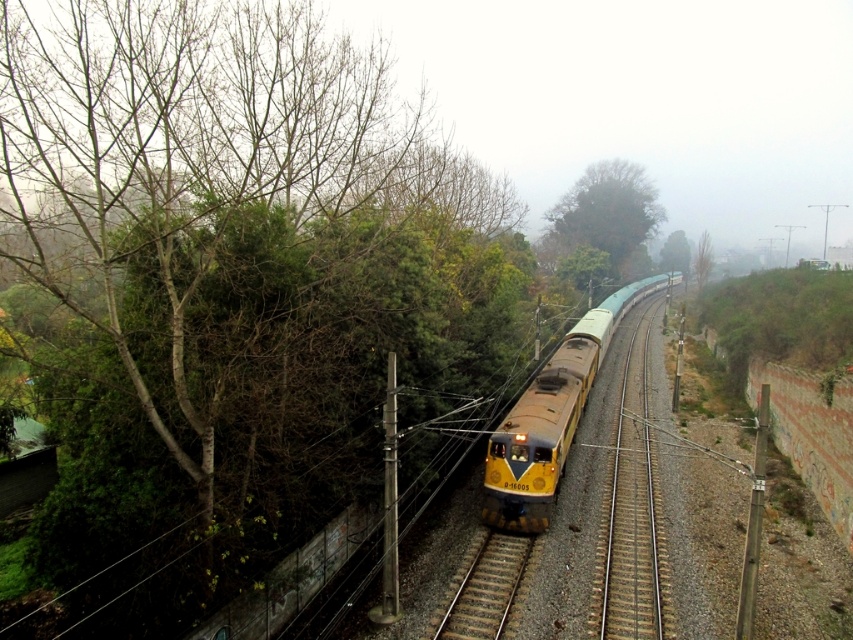
Is yellow metallic train at center wider than brown gravel track at center?

Yes, yellow metallic train at center is wider than brown gravel track at center.

You are a GUI agent. You are given a task and a screenshot of the screen. Output one action in this format:
    pyautogui.click(x=<x>, y=<y>)
    Task: Click on the yellow metallic train at center
    This screenshot has width=853, height=640.
    Given the screenshot: What is the action you would take?
    pyautogui.click(x=550, y=417)

Who is more distant from viewer, (656,280) or (483,634)?

Positioned behind is point (656,280).

This screenshot has height=640, width=853. What are the coordinates of `yellow metallic train at center` in the screenshot? It's located at (550, 417).

Who is lower down, green leafy tree at upper center or brown gravel track at center?

brown gravel track at center is below.

In the scene shown: Can you confirm if green leafy tree at upper center is positioned below brown gravel track at center?

No, green leafy tree at upper center is not below brown gravel track at center.

Is point (573, 186) closer to camera compared to point (489, 560)?

That is False.

Locate an element on the screen. This screenshot has width=853, height=640. green leafy tree at upper center is located at coordinates (606, 216).

Which is more to the right, yellow metallic train at center or green leafy tree at upper center?

green leafy tree at upper center is more to the right.

Who is more forward, [498,518] or [630,256]?

Point [498,518] is more forward.

Identify the location of yellow metallic train at center. (550, 417).